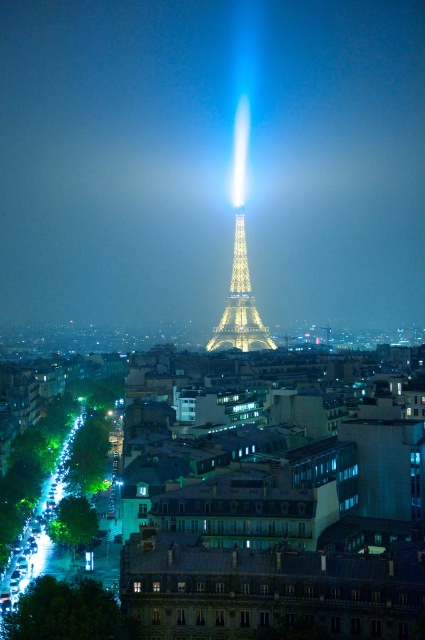
Does matte glass buildings at center have a larger size compared to illuminated steel eiffel tower at center?

Correct, matte glass buildings at center is larger in size than illuminated steel eiffel tower at center.

Is matte glass buildings at center thinner than illuminated steel eiffel tower at center?

No, matte glass buildings at center is not thinner than illuminated steel eiffel tower at center.

Who is more forward, (376, 406) or (274, 348)?

Positioned in front is point (376, 406).

The width and height of the screenshot is (425, 640). What are the coordinates of `matte glass buildings at center` in the screenshot? It's located at (274, 492).